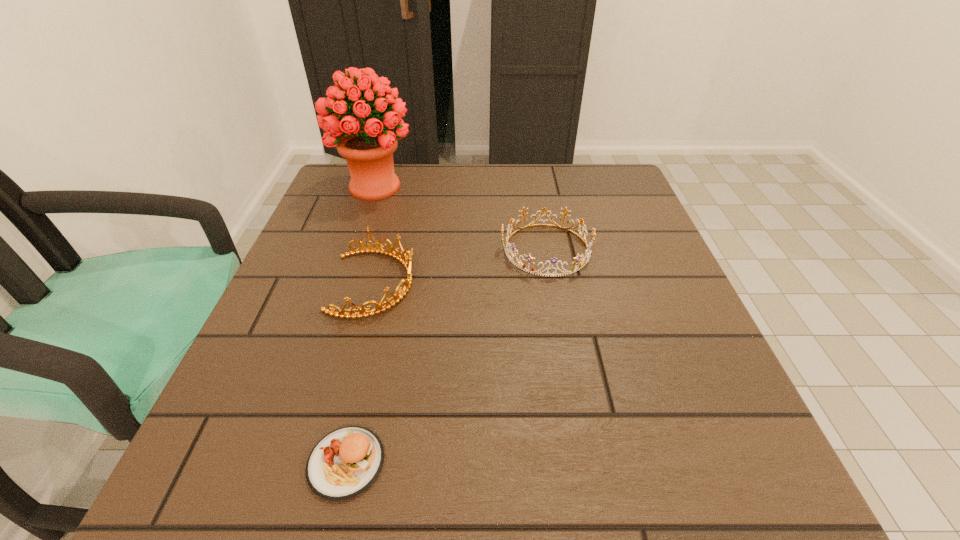
Locate an element on the screen. object that is positioned at the far left corner is located at coordinates (368, 147).

Where is `object located in the near left corner section of the desktop`? This screenshot has width=960, height=540. object located in the near left corner section of the desktop is located at coordinates (345, 462).

The width and height of the screenshot is (960, 540). In the image, there is a desktop. Find the location of `vacant space at the far edge`. vacant space at the far edge is located at coordinates (564, 183).

Where is `free space at the left edge`? The height and width of the screenshot is (540, 960). free space at the left edge is located at coordinates (315, 327).

Where is `vacant point at the right edge`? vacant point at the right edge is located at coordinates (612, 273).

In the image, there is a desktop. Where is `vacant space at the far right corner`? This screenshot has height=540, width=960. vacant space at the far right corner is located at coordinates (613, 171).

Where is `vacant space in between the right tiara and the shortest object`? vacant space in between the right tiara and the shortest object is located at coordinates (446, 356).

This screenshot has height=540, width=960. In order to click on empty space between the tallest object and the nearest object in this screenshot , I will do `click(361, 325)`.

This screenshot has height=540, width=960. Identify the location of empty space between the tallest object and the left tiara. (374, 235).

At what (x,y) coordinates should I click in order to perform the action: click on vacant area that lies between the third tallest object and the third shortest object. Please return your answer as a coordinate pair (x, y). Looking at the image, I should click on (460, 266).